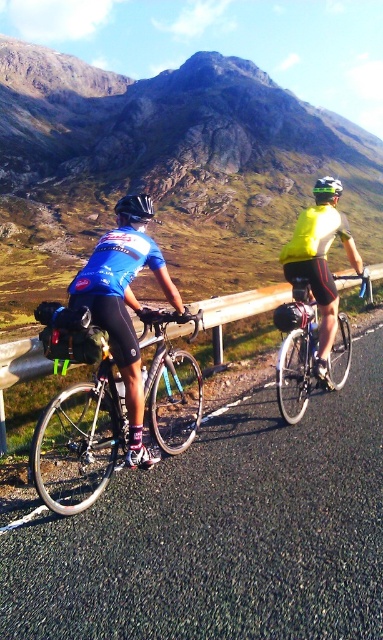
You are a cyclist riding along the road and want to pass the shiny black frame at left. Which direction should you move to avoid the brushed metal rail at center?

The shiny black frame at left is positioned under the brushed metal rail at center, so you should move to the right to avoid the brushed metal rail at center while passing the shiny black frame at left.

Based on the photo, you are a hiker planning to walk along the black asphalt road at center. You notice the shiny black helmet at left. Which object is longer in length?

The shiny black helmet at left is longer than the black asphalt road at center.

You are a delivery drone operator. Your drone has a wingspan of 3 feet. You need to fly between the shiny silver bicycle at right and the shiny black helmet at left. Can your drone safely pass through the space between them?

The shiny silver bicycle at right and shiny black helmet at left are 33.94 feet apart from each other. Since the drone has a wingspan of 3 feet, it can easily pass through the space between them as the distance is much larger than the drone.